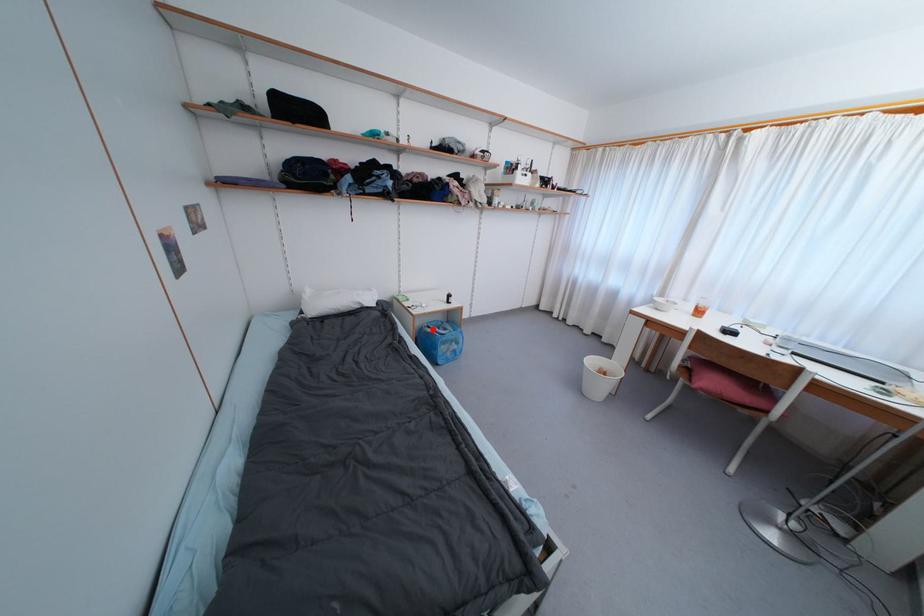
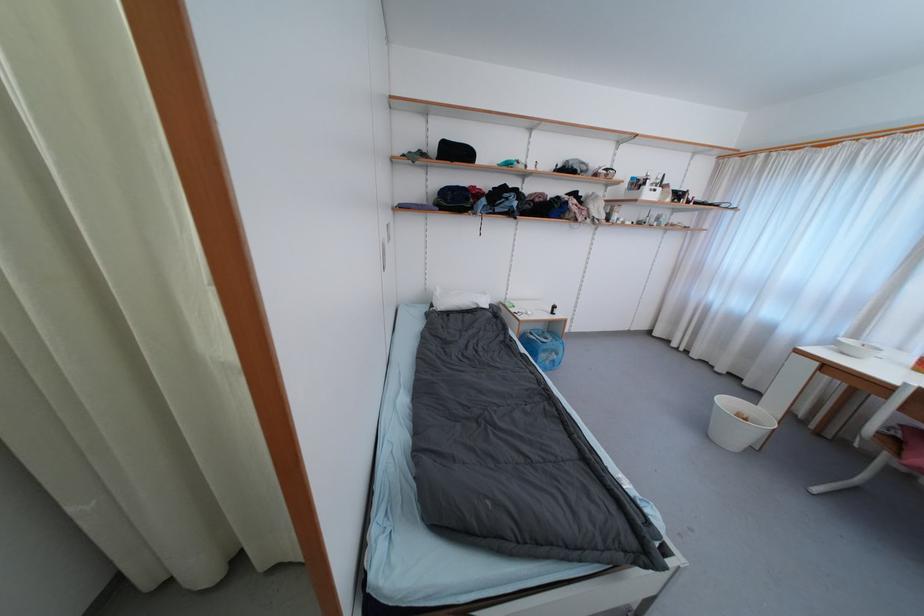
Where in the second image is the point corresponding to the highlighted location from the first image?

(535, 336)